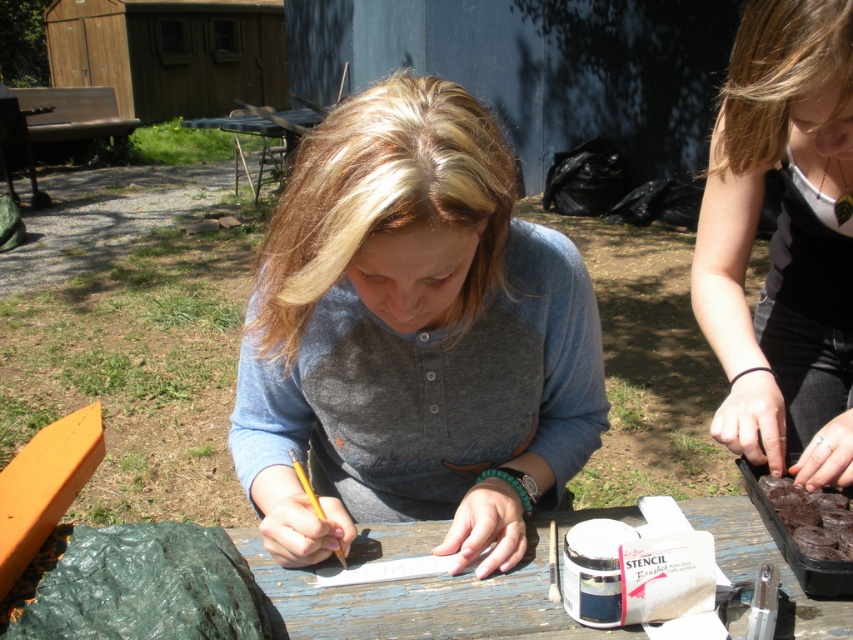
You are standing at the edge of the scene and want to hand a tool to both the matte gray shirt at center and the matte black shirt at upper right. Which one should you approach first to reach them in the shortest path?

The matte gray shirt at center is to the left of the matte black shirt at upper right, so you should approach the matte gray shirt at center first as it is closer to your starting position at the edge of the scene.

You are a photographer taking a picture of the scene. The matte gray shirt at center and dark chocolate cake at lower right are both in the frame. Which object is closer to the camera?

The matte gray shirt at center is closer to the camera because it is positioned over the dark chocolate cake at lower right, indicating it is in front.

You are planning to place the dark chocolate cake at lower right on the wooden table at center. Based on their sizes, will the cake fit on the table without hanging over the edges?

The wooden table at center is wider than the dark chocolate cake at lower right, so the cake will fit on the table without hanging over the edges.